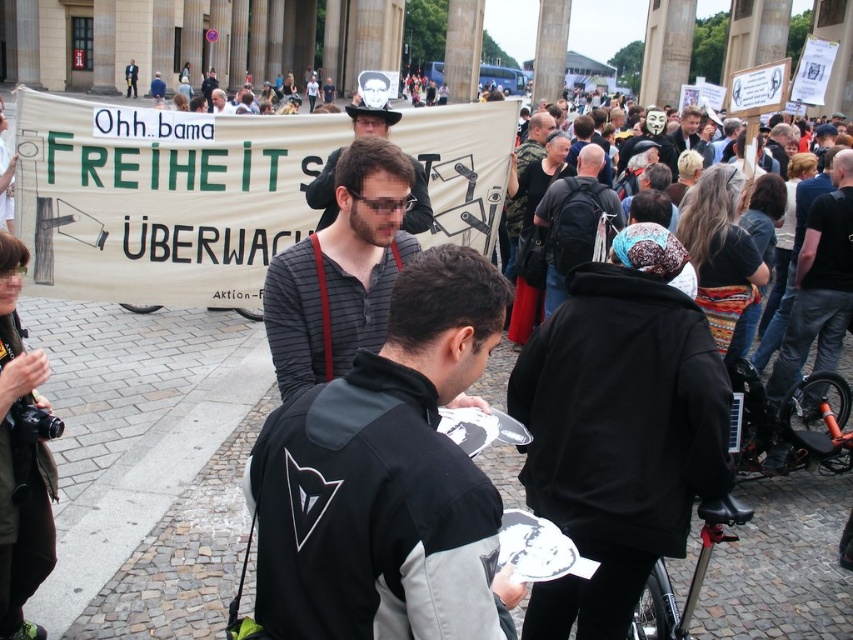
You are a photographer trying to capture the protest scene. You notice the black leather jacket at upper right and the dark gray backpack at center. Which object should you zoom in on to get a wider shot without moving the camera, considering their sizes?

The black leather jacket at upper right is wider than the dark gray backpack at center, so you should zoom in on the black leather jacket at upper right to capture a wider shot without moving the camera.

You are a photographer trying to capture a photo of the protest scene. You notice the black leather jacket at upper right and the dark gray backpack at center. Which object should you focus on to ensure it appears larger in your photo?

The black leather jacket at upper right is much taller than the dark gray backpack at center, so focusing on it will make it appear larger in the photo.